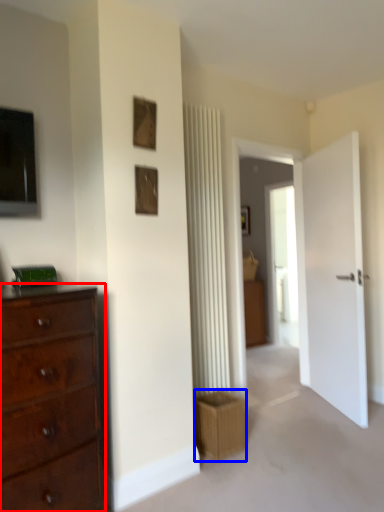
Question: Which object appears closest to the camera in this image, chest of drawers (highlighted by a red box) or crate (highlighted by a blue box)?

Choices:
 (A) chest of drawers
 (B) crate

Answer: (A)